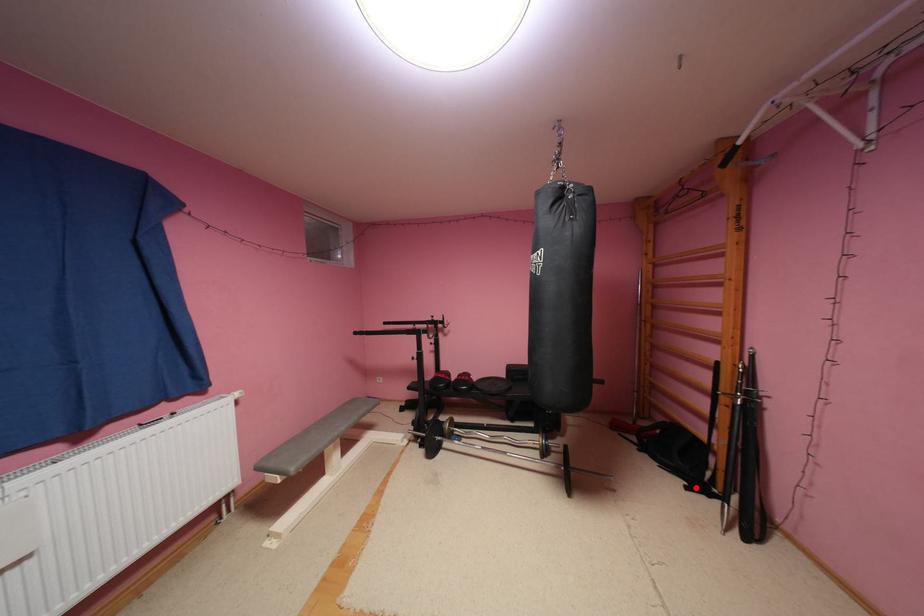
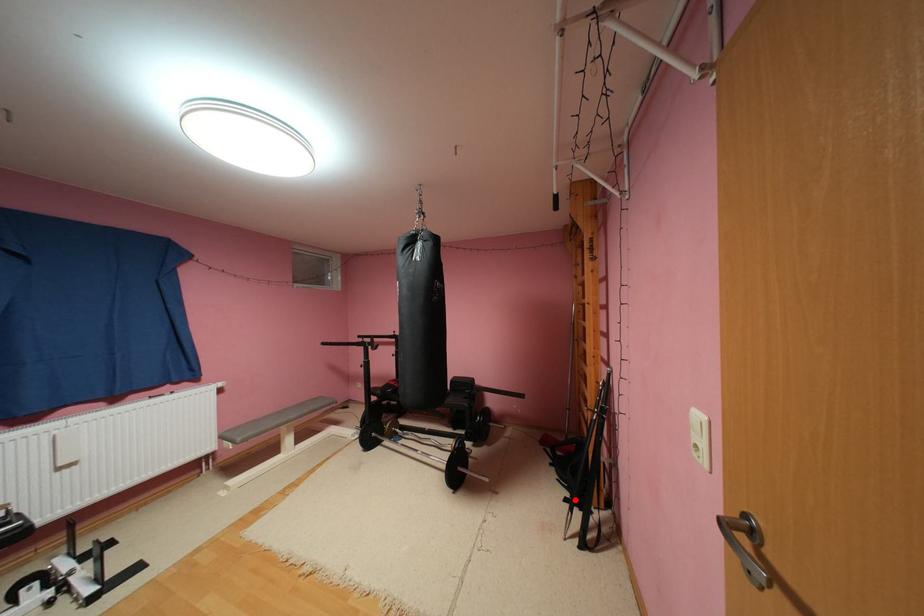
I am providing you with two images of the same scene from different viewpoints. A red point is marked on the first image and another point is marked on the second image. Is the red point in image1 aligned with the point shown in image2?

Yes